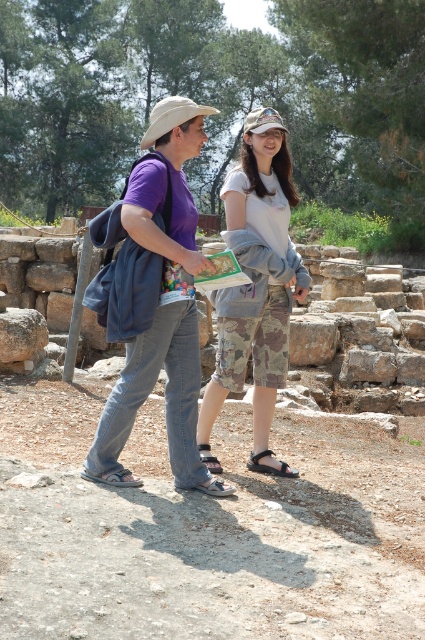
Is purple cotton shirt at center positioned at the back of camo fabric shorts at center?

No, it is in front of camo fabric shorts at center.

Who is positioned more to the right, purple cotton shirt at center or camo fabric shorts at center?

camo fabric shorts at center is more to the right.

The height and width of the screenshot is (640, 425). What are the coordinates of `purple cotton shirt at center` in the screenshot? It's located at (158, 301).

Identify the location of purple cotton shirt at center. (158, 301).

Between point (141, 332) and point (274, 109), which one is positioned behind?

Positioned behind is point (274, 109).

Describe the element at coordinates (158, 301) in the screenshot. I see `purple cotton shirt at center` at that location.

Locate an element on the screen. Image resolution: width=425 pixels, height=640 pixels. purple cotton shirt at center is located at coordinates (158, 301).

Can you confirm if camo shorts at center is positioned above camo fabric shorts at center?

Indeed, camo shorts at center is positioned over camo fabric shorts at center.

Does camo shorts at center have a lesser width compared to camo fabric shorts at center?

Incorrect, camo shorts at center's width is not less than camo fabric shorts at center's.

Find the location of `camo shorts at center`. camo shorts at center is located at coordinates (255, 285).